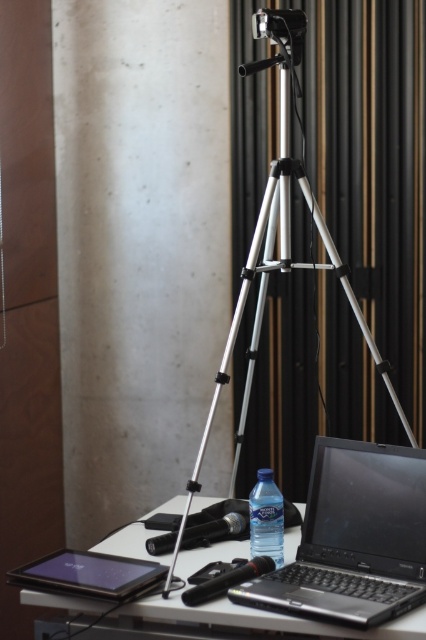
Consider the image. Does white plastic table at center have a greater height compared to clear plastic bottle at center?

Incorrect, white plastic table at center's height is not larger of clear plastic bottle at center's.

Can you confirm if white plastic table at center is positioned to the right of clear plastic bottle at center?

In fact, white plastic table at center is to the left of clear plastic bottle at center.

Identify the location of white plastic table at center. (270, 618).

Does silver metallic tripod at center have a greater width compared to white plastic table at center?

No, silver metallic tripod at center is not wider than white plastic table at center.

Who is more distant from viewer, (379, 358) or (386, 632)?

Positioned behind is point (379, 358).

In order to click on silver metallic tripod at center in this screenshot , I will do `click(275, 243)`.

Is silver metallic tripod at center wider than clear plastic bottle at center?

Yes, silver metallic tripod at center is wider than clear plastic bottle at center.

Is silver metallic tripod at center smaller than clear plastic bottle at center?

No.

Image resolution: width=426 pixels, height=640 pixels. I want to click on silver metallic tripod at center, so click(x=275, y=243).